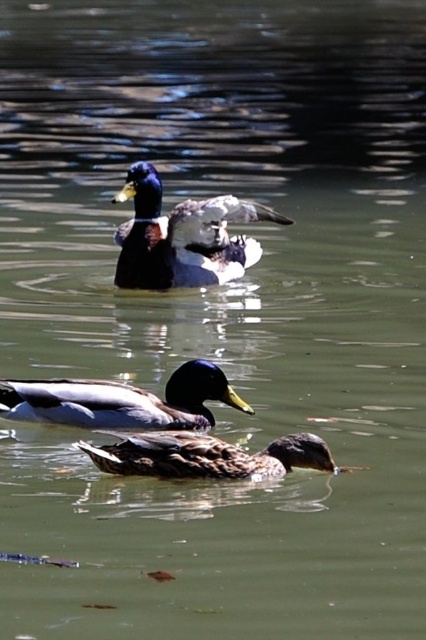
Question: Can you confirm if shiny green drake at upper center is positioned to the right of brown matte duck at lower center?

Choices:
 (A) no
 (B) yes

Answer: (A)

Question: Considering the real-world distances, which object is closest to the shiny brown duck at center?

Choices:
 (A) shiny green drake at upper center
 (B) brown matte duck at lower center

Answer: (B)

Question: Is shiny green drake at upper center to the left of brown matte duck at lower center from the viewer's perspective?

Choices:
 (A) no
 (B) yes

Answer: (B)

Question: Which of the following is the closest to the observer?

Choices:
 (A) (123, 419)
 (B) (129, 243)
 (C) (322, 458)

Answer: (C)

Question: Which is farther from the shiny green drake at upper center?

Choices:
 (A) shiny brown duck at center
 (B) brown matte duck at lower center

Answer: (B)

Question: Is shiny green drake at upper center behind brown matte duck at lower center?

Choices:
 (A) no
 (B) yes

Answer: (B)